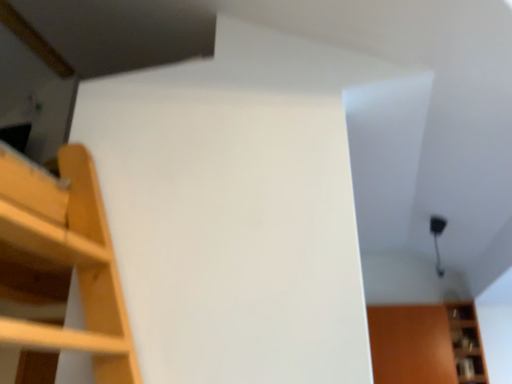
This screenshot has height=384, width=512. What do you see at coordinates (466, 343) in the screenshot?
I see `wooden at lower right` at bounding box center [466, 343].

Locate an element on the screen. The height and width of the screenshot is (384, 512). wooden at lower right is located at coordinates (466, 343).

What do you see at coordinates (426, 344) in the screenshot?
I see `matte brown cabinet at lower right` at bounding box center [426, 344].

Where is `matte brown cabinet at lower right`? This screenshot has width=512, height=384. matte brown cabinet at lower right is located at coordinates (426, 344).

At what (x,y) coordinates should I click in order to perform the action: click on wooden at lower right. Please return your answer as a coordinate pair (x, y). Image resolution: width=512 pixels, height=384 pixels. Looking at the image, I should click on (466, 343).

Is wooden at lower right to the left or to the right of matte brown cabinet at lower right in the image?

wooden at lower right is positioned on matte brown cabinet at lower right's right side.

Looking at this image, considering the relative positions of wooden at lower right and matte brown cabinet at lower right in the image provided, is wooden at lower right behind matte brown cabinet at lower right?

No, it is in front of matte brown cabinet at lower right.

Is point (469, 325) closer or farther from the camera than point (410, 323)?

Point (469, 325) is positioned farther from the camera compared to point (410, 323).

From the image's perspective, which one is positioned lower, wooden at lower right or matte brown cabinet at lower right?

From the image's view, matte brown cabinet at lower right is below.

From a real-world perspective, who is located higher, wooden at lower right or matte brown cabinet at lower right?

wooden at lower right, from a real-world perspective.

Which object is wider, wooden at lower right or matte brown cabinet at lower right?

matte brown cabinet at lower right is wider.

Considering the sizes of objects wooden at lower right and matte brown cabinet at lower right in the image provided, who is taller, wooden at lower right or matte brown cabinet at lower right?

wooden at lower right.

From the picture: Is wooden at lower right bigger than matte brown cabinet at lower right?

Incorrect, wooden at lower right is not larger than matte brown cabinet at lower right.

Is matte brown cabinet at lower right inside wooden at lower right?

Actually, matte brown cabinet at lower right is outside wooden at lower right.

Is wooden at lower right directly adjacent to matte brown cabinet at lower right?

No, wooden at lower right is not making contact with matte brown cabinet at lower right.

Is wooden at lower right positioned with its back to matte brown cabinet at lower right?

No, matte brown cabinet at lower right is not at the back of wooden at lower right.

Find the location of a particular element. shelf to the right of matte brown cabinet at lower right is located at coordinates (466, 343).

Would you say matte brown cabinet at lower right is to the left or to the right of wooden at lower right in the picture?

Based on their positions, matte brown cabinet at lower right is located to the left of wooden at lower right.

Consider the image. Relative to wooden at lower right, is matte brown cabinet at lower right in front or behind?

matte brown cabinet at lower right is positioned farther from the viewer than wooden at lower right.

Considering the positions of points (443, 321) and (468, 375), is point (443, 321) closer to camera compared to point (468, 375)?

No, it is behind (468, 375).

From the image's perspective, is matte brown cabinet at lower right above or below wooden at lower right?

matte brown cabinet at lower right is situated lower than wooden at lower right in the image.

From a real-world perspective, is matte brown cabinet at lower right on wooden at lower right?

Incorrect, from a real-world perspective, matte brown cabinet at lower right is lower than wooden at lower right.

Which of these two, matte brown cabinet at lower right or wooden at lower right, is wider?

Wider between the two is matte brown cabinet at lower right.

Between matte brown cabinet at lower right and wooden at lower right, which one has more height?

Standing taller between the two is wooden at lower right.

Is matte brown cabinet at lower right bigger or smaller than wooden at lower right?

In the image, matte brown cabinet at lower right appears to be larger than wooden at lower right.

Would you say matte brown cabinet at lower right is inside or outside wooden at lower right?

matte brown cabinet at lower right is outside wooden at lower right.

Is there a large distance between matte brown cabinet at lower right and wooden at lower right?

matte brown cabinet at lower right is near wooden at lower right, not far away.

Is matte brown cabinet at lower right oriented away from wooden at lower right?

That's not correct — matte brown cabinet at lower right is not looking away from wooden at lower right.

How many degrees apart are the facing directions of matte brown cabinet at lower right and wooden at lower right?

0.000607 degrees separate the facing orientations of matte brown cabinet at lower right and wooden at lower right.

Image resolution: width=512 pixels, height=384 pixels. What are the coordinates of `shelf to the right of matte brown cabinet at lower right` in the screenshot? It's located at (466, 343).

The width and height of the screenshot is (512, 384). In order to click on shelf located above the matte brown cabinet at lower right (from the image's perspective) in this screenshot , I will do `click(466, 343)`.

The height and width of the screenshot is (384, 512). What are the coordinates of `shelf located on the right of matte brown cabinet at lower right` in the screenshot? It's located at (466, 343).